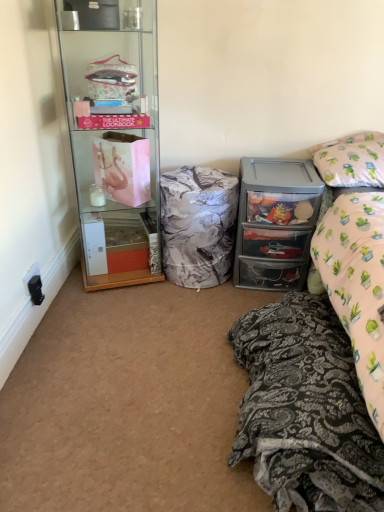
Image resolution: width=384 pixels, height=512 pixels. I want to click on pink fabric pillow at upper right, so click(x=351, y=160).

In order to face black plastic power outlet at lower left, should I rotate leftwards or rightwards?

To face it directly, rotate left by 20.556 degrees.

Find the location of a particular element. black plastic power outlet at lower left is located at coordinates (34, 284).

The width and height of the screenshot is (384, 512). What do you see at coordinates (320, 359) in the screenshot?
I see `patterned fabric bed at lower right` at bounding box center [320, 359].

What is the approximate width of patterned fabric bed at lower right?

patterned fabric bed at lower right is 35.46 inches wide.

Measure the distance between clear glass cabinet at left and camera.

1.66 meters.

Find the location of a particular element. This screenshot has height=512, width=384. clear plastic drawers at right is located at coordinates (275, 222).

From the image's perspective, which one is positioned lower, clear plastic drawers at right or pink fabric pillow at upper right?

clear plastic drawers at right appears lower in the image.

Is clear plastic drawers at right to the left or to the right of pink fabric pillow at upper right in the image?

In the image, clear plastic drawers at right appears on the left side of pink fabric pillow at upper right.

Which point is more distant from viewer, (x=250, y=193) or (x=329, y=164)?

The point (x=329, y=164) is more distant.

How many degrees apart are the facing directions of clear plastic drawers at right and pink fabric pillow at upper right?

They differ by 4.55 degrees in their facing directions.

Which is behind, pink fabric pillow at upper right or clear glass cabinet at left?

pink fabric pillow at upper right is behind.

From the picture: Is pink fabric pillow at upper right beside clear glass cabinet at left?

No.

Between pink fabric pillow at upper right and clear glass cabinet at left, which one appears on the left side from the viewer's perspective?

clear glass cabinet at left.

Who is smaller, patterned fabric bed at lower right or marble-patterned fabric at center?

marble-patterned fabric at center is smaller.

Is patterned fabric bed at lower right oriented towards marble-patterned fabric at center?

No, patterned fabric bed at lower right is not aimed at marble-patterned fabric at center.

Visually, is patterned fabric bed at lower right positioned to the left or to the right of marble-patterned fabric at center?

In the image, patterned fabric bed at lower right appears on the right side of marble-patterned fabric at center.

From a real-world perspective, relative to marble-patterned fabric at center, is patterned fabric bed at lower right vertically above or below?

From a real-world perspective, patterned fabric bed at lower right is physically below marble-patterned fabric at center.

Is black plastic power outlet at lower left next to clear glass cabinet at left?

There is a gap between black plastic power outlet at lower left and clear glass cabinet at left.

Is black plastic power outlet at lower left not inside clear glass cabinet at left?

Yes, black plastic power outlet at lower left is located beyond the bounds of clear glass cabinet at left.

Does point (36, 285) lie in front of point (107, 91)?

Yes, point (36, 285) is closer to viewer.

Measure the distance from black plastic power outlet at lower left to clear glass cabinet at left.

black plastic power outlet at lower left is 28.70 inches away from clear glass cabinet at left.

Can you confirm if clear plastic drawers at right is taller than marble-patterned fabric at center?

Yes, clear plastic drawers at right is taller than marble-patterned fabric at center.

Considering the sizes of objects clear plastic drawers at right and marble-patterned fabric at center in the image provided, who is bigger, clear plastic drawers at right or marble-patterned fabric at center?

Answer: clear plastic drawers at right is bigger.

From the picture: From the image's perspective, does clear plastic drawers at right appear higher than marble-patterned fabric at center?

Yes, from the image's perspective, clear plastic drawers at right is on top of marble-patterned fabric at center.

Is pink fabric pillow at upper right further to the viewer compared to patterned fabric bed at lower right?

Yes, pink fabric pillow at upper right is further from the camera.

Is pink fabric pillow at upper right to the left of patterned fabric bed at lower right from the viewer's perspective?

In fact, pink fabric pillow at upper right is to the right of patterned fabric bed at lower right.

Is pink fabric pillow at upper right not close to patterned fabric bed at lower right?

They are positioned close to each other.

Is pink fabric pillow at upper right surrounding patterned fabric bed at lower right?

No, pink fabric pillow at upper right does not contain patterned fabric bed at lower right.

From the image's perspective, is black plastic power outlet at lower left on marble-patterned fabric at center?

No.

Which object is wider, black plastic power outlet at lower left or marble-patterned fabric at center?

Wider between the two is marble-patterned fabric at center.

Between black plastic power outlet at lower left and marble-patterned fabric at center, which one has more height?

Standing taller between the two is marble-patterned fabric at center.

The height and width of the screenshot is (512, 384). I want to click on power outlet to the left of marble-patterned fabric at center, so click(34, 284).

You are a GUI agent. You are given a task and a screenshot of the screen. Output one action in this format:
    pyautogui.click(x=<x>, y=<y>)
    Task: Click on the pillow that is above the clear plastic drawers at right (from a real-world perspective)
    
    Given the screenshot: What is the action you would take?
    pyautogui.click(x=351, y=160)

Find the location of a particular element. This screenshot has width=384, height=512. pillow lying behind the clear glass cabinet at left is located at coordinates (351, 160).

Looking at the image, which one is located closer to clear glass cabinet at left, patterned fabric bed at lower right or black plastic power outlet at lower left?

black plastic power outlet at lower left lies closer to clear glass cabinet at left than the other object.

Estimate the real-world distances between objects in this image. Which object is closer to patterned fabric bed at lower right, marble-patterned fabric at center or clear plastic drawers at right?

clear plastic drawers at right is positioned closer to the anchor patterned fabric bed at lower right.

Looking at the image, which one is located closer to patterned fabric bed at lower right, clear glass cabinet at left or black plastic power outlet at lower left?

clear glass cabinet at left is closer to patterned fabric bed at lower right.

Which object lies nearer to the anchor point clear glass cabinet at left, marble-patterned fabric at center or patterned fabric bed at lower right?

Based on the image, marble-patterned fabric at center appears to be nearer to clear glass cabinet at left.

Looking at the image, which one is located further to black plastic power outlet at lower left, marble-patterned fabric at center or pink fabric pillow at upper right?

Among the two, pink fabric pillow at upper right is located further to black plastic power outlet at lower left.

Which object lies further to the anchor point marble-patterned fabric at center, patterned fabric bed at lower right or clear glass cabinet at left?

Based on the image, patterned fabric bed at lower right appears to be further to marble-patterned fabric at center.

Which object lies further to the anchor point marble-patterned fabric at center, pink fabric pillow at upper right or patterned fabric bed at lower right?

pink fabric pillow at upper right lies further to marble-patterned fabric at center than the other object.

Considering their positions, is marble-patterned fabric at center positioned further to clear glass cabinet at left than pink fabric pillow at upper right?

The object further to clear glass cabinet at left is pink fabric pillow at upper right.

Find the location of a particular element. cabinetry between black plastic power outlet at lower left and pink fabric pillow at upper right from left to right is located at coordinates (275, 222).

Identify the location of cabinetry between clear glass cabinet at left and patterned fabric bed at lower right in the up-down direction. (275, 222).

The image size is (384, 512). Find the location of `material between clear glass cabinet at left and patterned fabric bed at lower right in the vertical direction`. material between clear glass cabinet at left and patterned fabric bed at lower right in the vertical direction is located at coordinates (198, 226).

You are a GUI agent. You are given a task and a screenshot of the screen. Output one action in this format:
    pyautogui.click(x=<x>, y=<y>)
    Task: Click on the desk situated between black plastic power outlet at lower left and pink fabric pillow at upper right from left to right
    
    Given the screenshot: What is the action you would take?
    pyautogui.click(x=113, y=136)